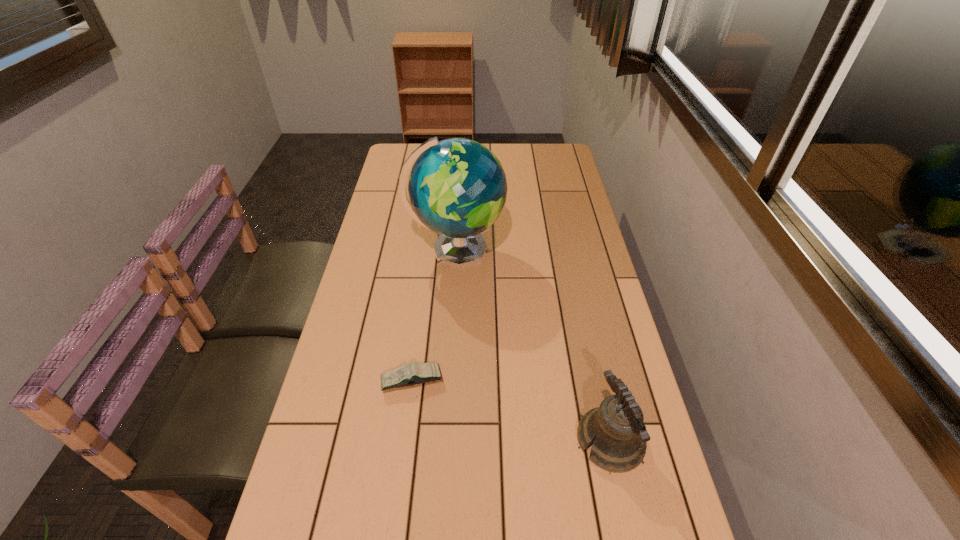
In order to click on globe in this screenshot , I will do `click(457, 187)`.

The width and height of the screenshot is (960, 540). Find the location of `the tallest object`. the tallest object is located at coordinates (457, 187).

Where is `the second tallest object`? Image resolution: width=960 pixels, height=540 pixels. the second tallest object is located at coordinates (617, 427).

Identify the location of the rightmost object. The width and height of the screenshot is (960, 540). (617, 427).

The height and width of the screenshot is (540, 960). What are the coordinates of `the shortest object` in the screenshot? It's located at (415, 373).

The width and height of the screenshot is (960, 540). Identify the location of the second nearest object. (415, 373).

Locate an element on the screen. The height and width of the screenshot is (540, 960). free region located on the front surface of the farthest object is located at coordinates (541, 252).

The image size is (960, 540). Identify the location of free point located on the back of the second tallest object. (593, 366).

You are a GUI agent. You are given a task and a screenshot of the screen. Output one action in this format:
    pyautogui.click(x=<x>, y=<y>)
    Task: Click on the vacant region located 0.150m on the right of the diary
    This screenshot has width=960, height=540.
    Given the screenshot: What is the action you would take?
    pyautogui.click(x=505, y=380)

At what (x,y) coordinates should I click in order to perform the action: click on globe that is at the left edge. Please return your answer as a coordinate pair (x, y). Image resolution: width=960 pixels, height=540 pixels. Looking at the image, I should click on (457, 187).